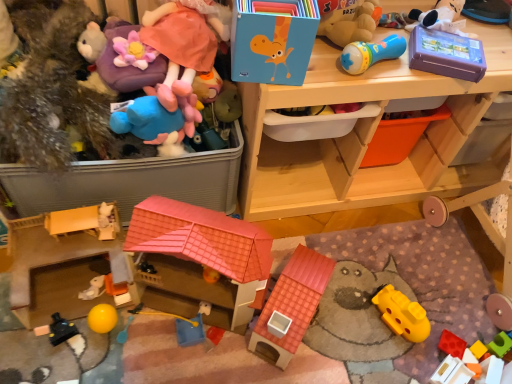
This screenshot has height=384, width=512. Identify the location of vacant space that is in between black plastic toy at lower left, positioned as the 2th toy in left-to-right order, and blue plastic toy at center, the 7th toy viewed from the right. coord(134,336).